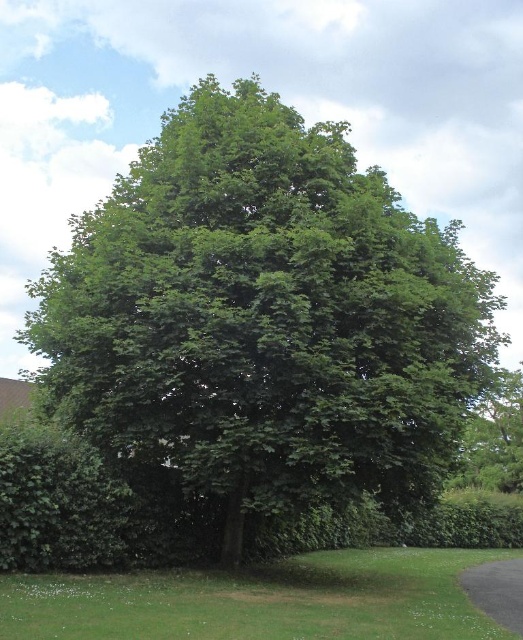
You are standing in the park and see two points marked in the image. Which point is closer to you, point (98, 280) or point (501, 612)?

Point (98, 280) is closer to you because it is further to the viewer than point (501, 612).

You are standing in a garden and want to take a photo of the green leafy tree at center. However, you notice the black asphalt driveway at lower right might be distracting in the background. Based on their sizes, which object would you move closer to or farther from to make the tree the main focus?

To make the green leafy tree at center the main focus, you should move closer to it since it is larger compared to the black asphalt driveway at lower right, which would reduce the driveway in the background and emphasize the tree.

You are a gardener trying to plant a new tree in your backyard. You have a space that can accommodate a tree up to the width of the black asphalt driveway at lower right. Based on the image, will the green leafy tree at center fit in your space?

The green leafy tree at center is wider than the black asphalt driveway at lower right, so it will not fit in the space allocated for a tree of the driveway width.